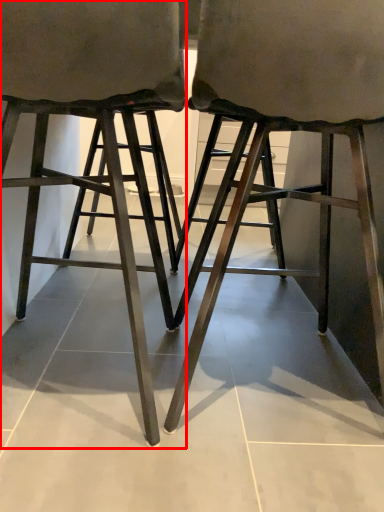
Question: Where is stool (annotated by the red box) located in relation to stool in the image?

Choices:
 (A) right
 (B) left

Answer: (B)